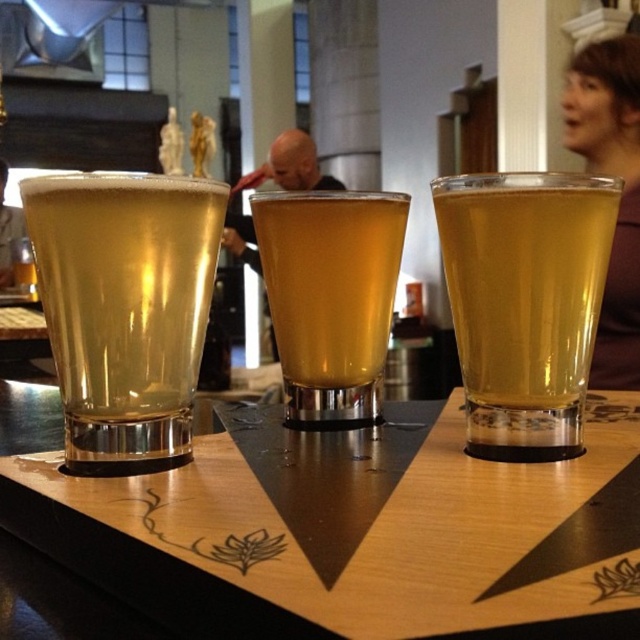
Is translucent glass at center positioned behind brown fabric shirt at upper right?

That is False.

Between point (561, 388) and point (612, 296), which one is positioned behind?

Point (612, 296)

You are a GUI agent. You are given a task and a screenshot of the screen. Output one action in this format:
    pyautogui.click(x=<x>, y=<y>)
    Task: Click on the translucent glass at center
    This screenshot has width=640, height=640.
    Given the screenshot: What is the action you would take?
    pyautogui.click(x=524, y=301)

Image resolution: width=640 pixels, height=640 pixels. What do you see at coordinates (621, 195) in the screenshot?
I see `brown fabric shirt at upper right` at bounding box center [621, 195].

Who is more forward, [611,332] or [275,180]?

Point [611,332] is more forward.

Locate an element on the screen. The height and width of the screenshot is (640, 640). brown fabric shirt at upper right is located at coordinates (621, 195).

Find the location of a particular element. This screenshot has height=640, width=640. brown fabric shirt at upper right is located at coordinates (621, 195).

Consider the image. Does wooden tray at center appear under bald head at center?

Indeed, wooden tray at center is positioned under bald head at center.

Between point (509, 627) and point (285, 141), which one is positioned in front?

Point (509, 627)

The height and width of the screenshot is (640, 640). In order to click on wooden tray at center in this screenshot , I will do `click(355, 531)`.